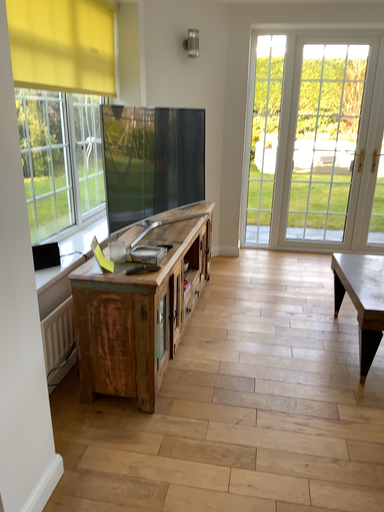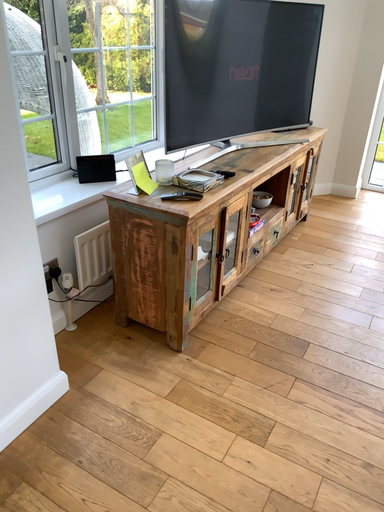
Question: Which way did the camera rotate in the video?

Choices:
 (A) rotated right
 (B) rotated left

Answer: (B)